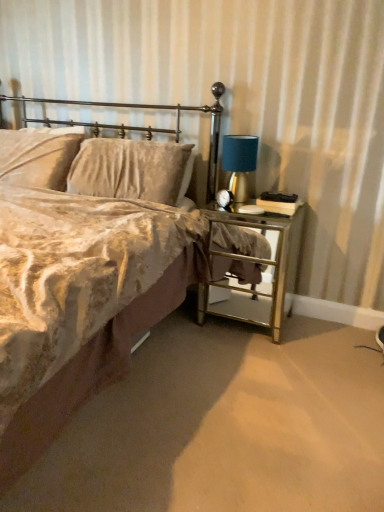
The width and height of the screenshot is (384, 512). Identify the location of free location in front of gold mirrored nightstand at right. (252, 361).